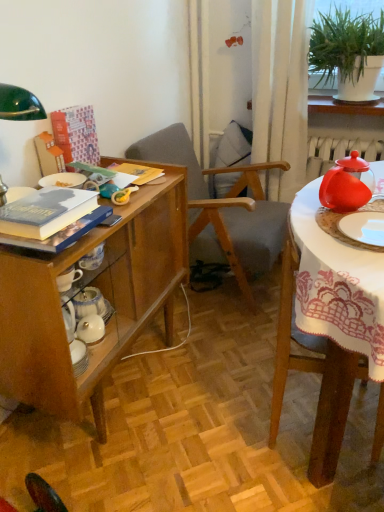
Question: Is wooden chair at right, the second chair in the back-to-front sequence, bigger than hardcover book at upper left, the first book positioned from the back?

Choices:
 (A) yes
 (B) no

Answer: (A)

Question: From a real-world perspective, is wooden chair at right, the second chair in the back-to-front sequence, located higher than hardcover book at upper left, the first book positioned from the back?

Choices:
 (A) yes
 (B) no

Answer: (B)

Question: Is wooden chair at right, the second chair in the back-to-front sequence, positioned beyond the bounds of hardcover book at upper left, positioned as the 1th book in top-to-bottom order?

Choices:
 (A) yes
 (B) no

Answer: (A)

Question: Is wooden chair at right, the 1th chair positioned from the front, to the left of hardcover book at upper left, positioned as the 1th book in top-to-bottom order, from the viewer's perspective?

Choices:
 (A) no
 (B) yes

Answer: (A)

Question: Is wooden chair at right, the 1th chair positioned from the front, turned away from hardcover book at upper left, the first book positioned from the back?

Choices:
 (A) yes
 (B) no

Answer: (B)

Question: From their relative heights in the image, would you say white glossy plate at right, arranged as the 1th tableware when ordered from the bottom, is taller or shorter than green leafy plant at upper right?

Choices:
 (A) tall
 (B) short

Answer: (B)

Question: In the image, is white glossy plate at right, arranged as the 1th tableware when ordered from the bottom, on the left side or the right side of green leafy plant at upper right?

Choices:
 (A) right
 (B) left

Answer: (B)

Question: Is point (359, 232) positioned closer to the camera than point (316, 23)?

Choices:
 (A) closer
 (B) farther

Answer: (A)

Question: From a real-world perspective, is white glossy plate at right, arranged as the 1th tableware when ordered from the bottom, physically located above or below green leafy plant at upper right?

Choices:
 (A) above
 (B) below

Answer: (B)

Question: From the image's perspective, relative to wooden desk at left, is hardcover book at left, acting as the first book starting from the bottom, above or below?

Choices:
 (A) above
 (B) below

Answer: (A)

Question: From a real-world perspective, is hardcover book at left, which is the first book in front-to-back order, positioned above or below wooden desk at left?

Choices:
 (A) above
 (B) below

Answer: (A)

Question: Based on their sizes in the image, would you say hardcover book at left, which is counted as the 2th book, starting from the top, is bigger or smaller than wooden desk at left?

Choices:
 (A) small
 (B) big

Answer: (A)

Question: Would you say hardcover book at left, acting as the first book starting from the bottom, is to the left or to the right of wooden desk at left in the picture?

Choices:
 (A) left
 (B) right

Answer: (A)

Question: Is point (292, 31) positioned closer to the camera than point (374, 234)?

Choices:
 (A) farther
 (B) closer

Answer: (A)

Question: From the image's perspective, is white sheer curtain at upper right positioned above or below white glossy plate at right, arranged as the second tableware when viewed from the top?

Choices:
 (A) below
 (B) above

Answer: (B)